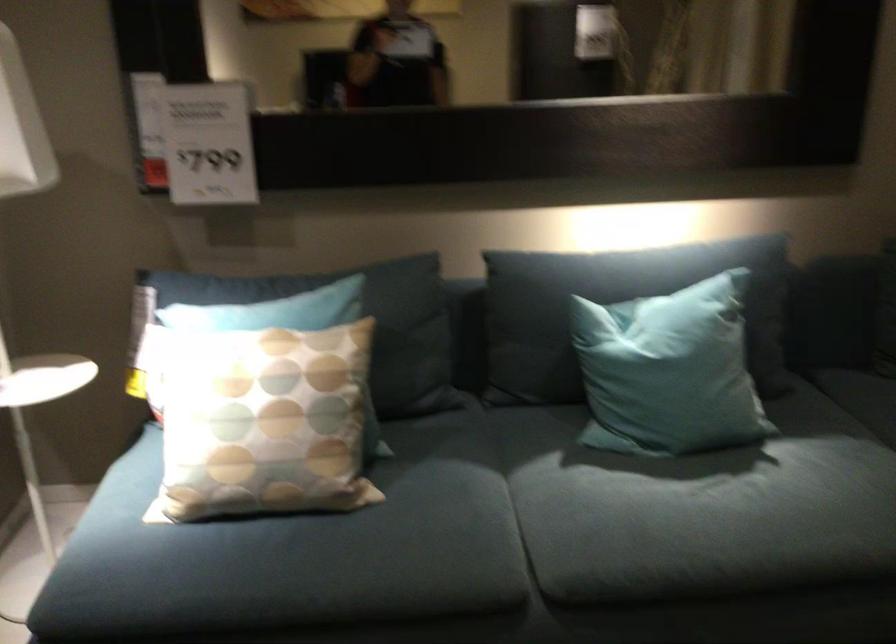
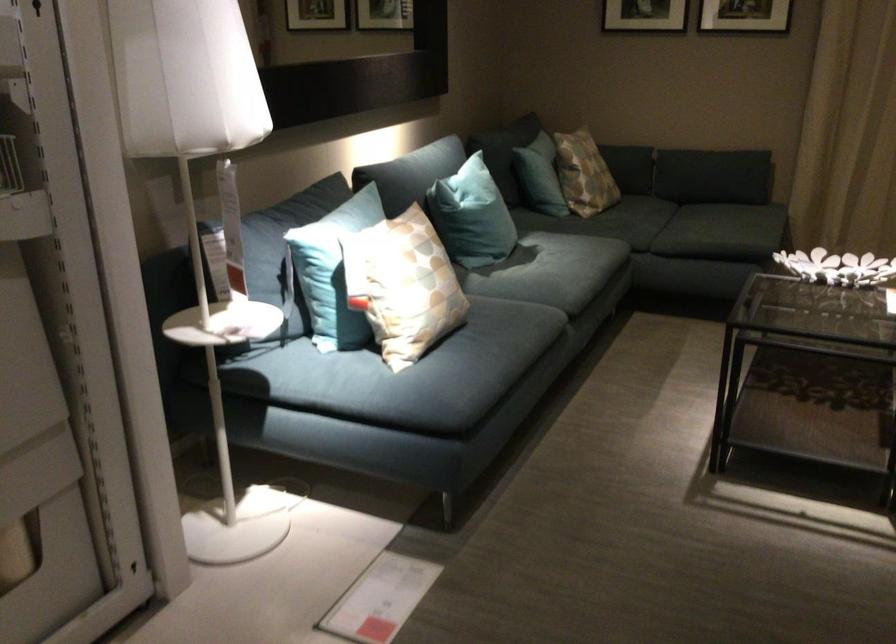
The point at (x=613, y=365) is marked in the first image. Where is the corresponding point in the second image?

(471, 216)